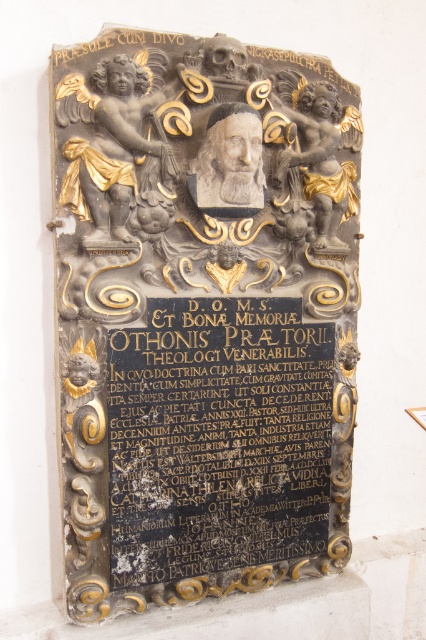
You are standing 5 feet away from the stone memorial plaque. You want to touch the point at coordinate point [172,541] on the plaque. Can you reach it without moving closer?

The distance of point [172,541] from camera is 6.15 feet. Since you are standing 5 feet away from the plaque, you are 1 foot too far to reach the point without moving closer.